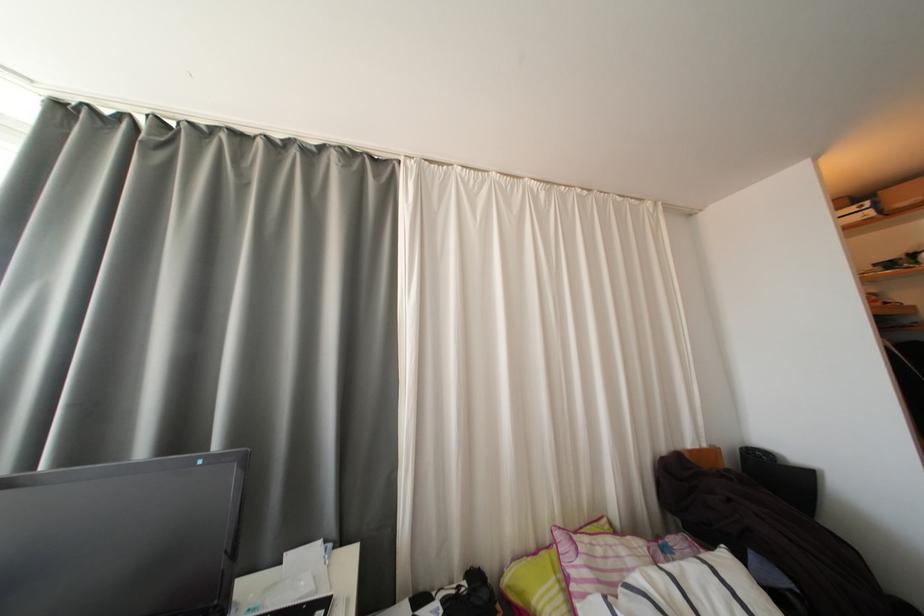
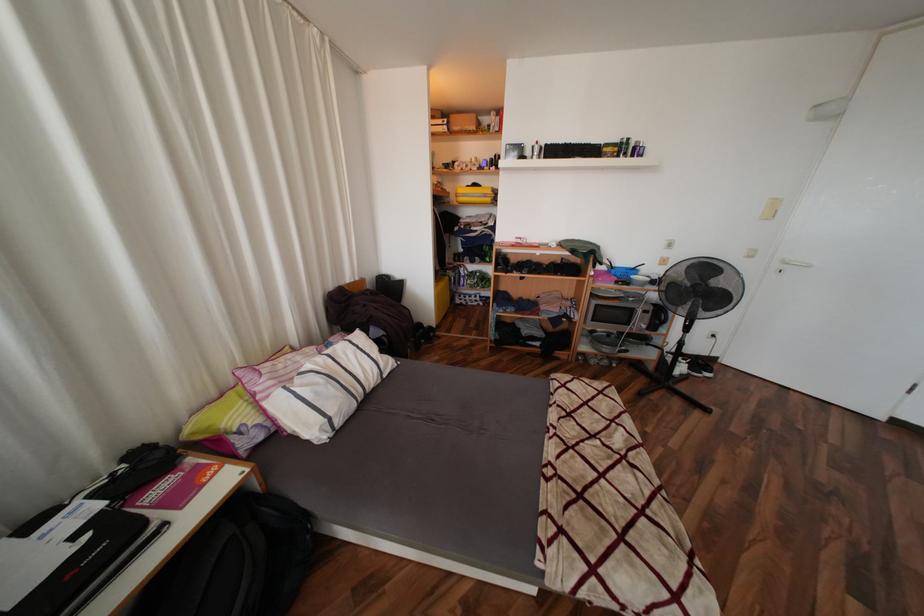
The first image is from the beginning of the video and the second image is from the end. How did the camera likely rotate when shooting the video?

The camera rotated toward right-down.